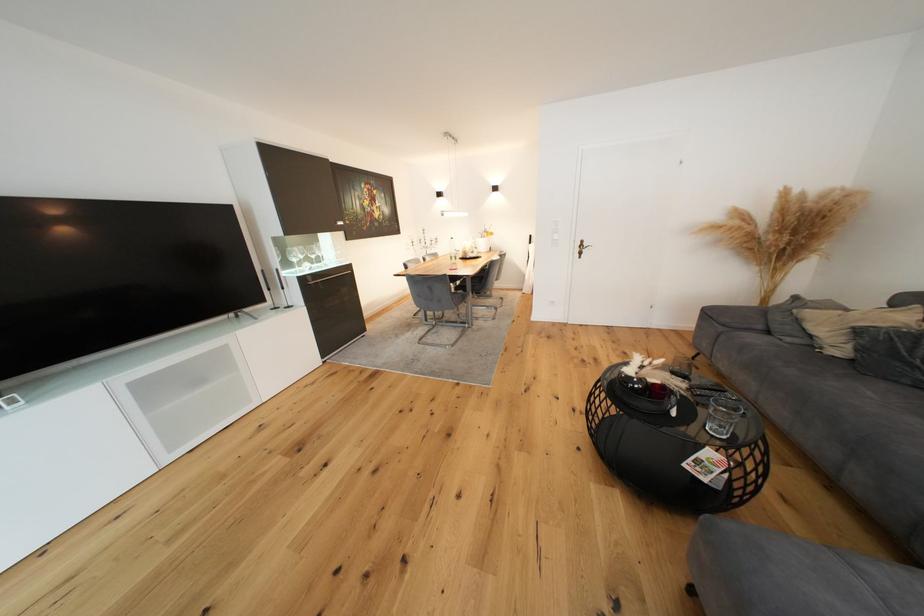
You are a GUI agent. You are given a task and a screenshot of the screen. Output one action in this format:
    pyautogui.click(x=<x>, y=<y>)
    Task: Click on the grey chair sitting surface
    The width and height of the screenshot is (924, 616).
    Given the screenshot: What is the action you would take?
    pyautogui.click(x=457, y=294)